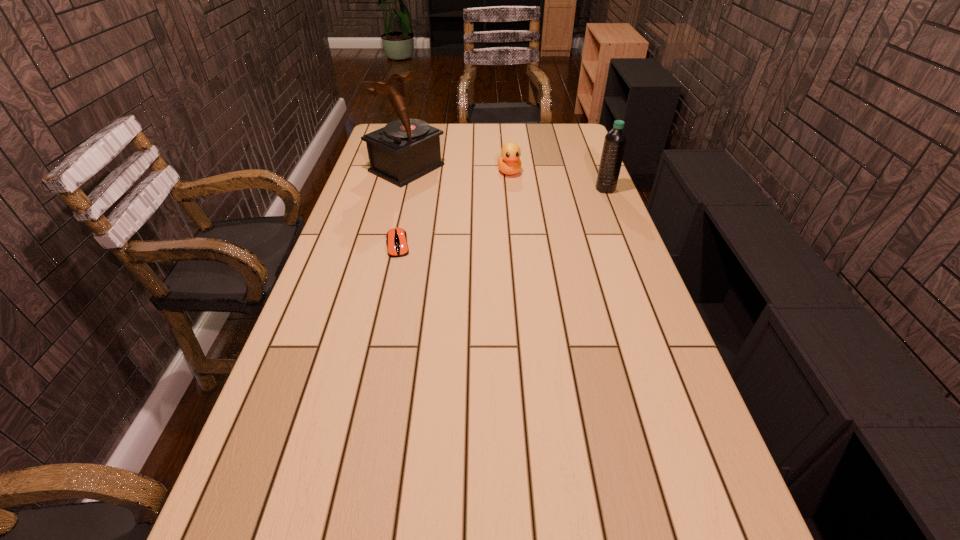
At what (x,y) coordinates should I click in order to perform the action: click on free spot at the right edge of the desktop. Please return your answer as a coordinate pair (x, y). Image resolution: width=960 pixels, height=540 pixels. Looking at the image, I should click on (636, 312).

You are a GUI agent. You are given a task and a screenshot of the screen. Output one action in this format:
    pyautogui.click(x=<x>, y=<y>)
    Task: Click on the vacant point at the near left corner
    
    Given the screenshot: What is the action you would take?
    pyautogui.click(x=309, y=468)

I want to click on free space between the duckling and the shortest object, so click(x=454, y=208).

This screenshot has height=540, width=960. Find the location of `free space between the tallest object and the water bottle`. free space between the tallest object and the water bottle is located at coordinates (506, 179).

The width and height of the screenshot is (960, 540). Find the location of `unoccupied area between the shortest object and the phonograph_record`. unoccupied area between the shortest object and the phonograph_record is located at coordinates (402, 206).

The image size is (960, 540). What are the coordinates of `free space between the nearest object and the rightmost object` in the screenshot? It's located at (502, 217).

This screenshot has width=960, height=540. I want to click on free point between the duckling and the water bottle, so click(557, 180).

The image size is (960, 540). Find the location of `vacant point located between the third object from left to right and the shortest object`. vacant point located between the third object from left to right and the shortest object is located at coordinates (454, 208).

Where is `vacant space in between the tallest object and the third tallest object`? This screenshot has height=540, width=960. vacant space in between the tallest object and the third tallest object is located at coordinates (458, 170).

Find the location of a particular element. free point between the computer mouse and the second tallest object is located at coordinates (502, 217).